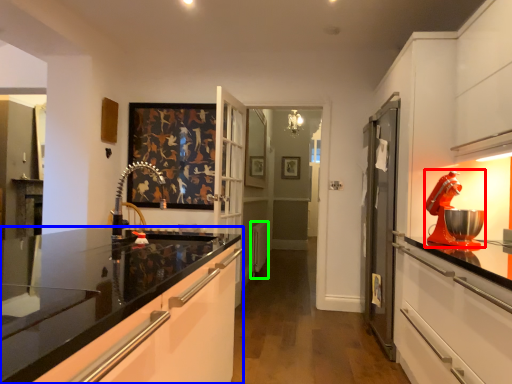
Question: Based on their relative distances, which object is farther from home appliance (highlighted by a red box)? Choose from cabinetry (highlighted by a blue box) and appliance (highlighted by a green box).

Choices:
 (A) cabinetry
 (B) appliance

Answer: (B)